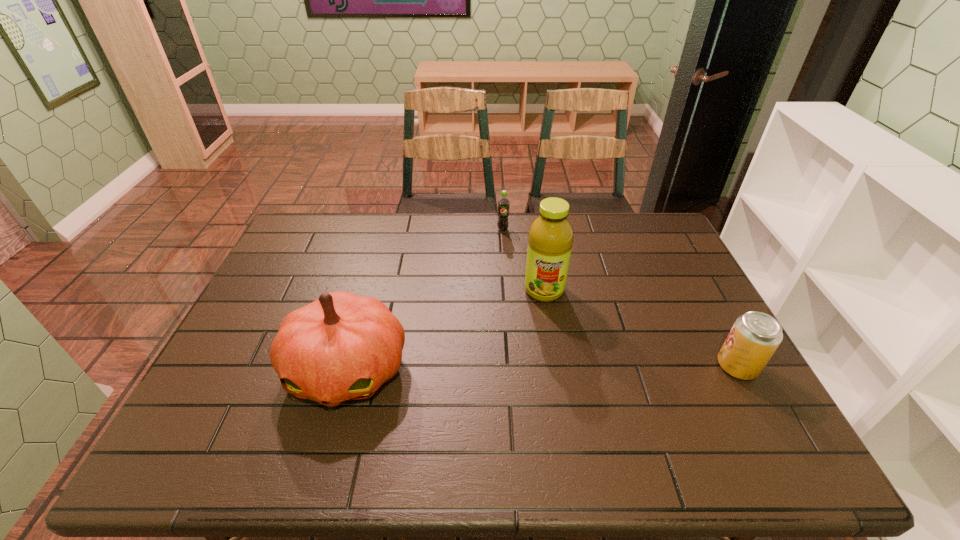
Where is `free space at the left edge`? The image size is (960, 540). free space at the left edge is located at coordinates (267, 279).

Where is `vacant space at the far right corner`? This screenshot has height=540, width=960. vacant space at the far right corner is located at coordinates (635, 226).

This screenshot has width=960, height=540. I want to click on blank region between the nearer soda and the pumpkin, so click(x=542, y=368).

Where is `free point between the second object from left to right and the third nearest object`? Image resolution: width=960 pixels, height=540 pixels. free point between the second object from left to right and the third nearest object is located at coordinates (523, 260).

At what (x,y) coordinates should I click in order to perform the action: click on empty space between the third object from right to left and the right soda. Please return your answer as a coordinate pair (x, y). Looking at the image, I should click on (620, 298).

This screenshot has width=960, height=540. I want to click on vacant space that's between the fruit juice and the left soda, so click(523, 260).

Find the location of `unoccupied area between the leftmost object and the second object from left to right`. unoccupied area between the leftmost object and the second object from left to right is located at coordinates (425, 300).

Locate an element on the screen. This screenshot has height=540, width=960. free space between the right soda and the farthest object is located at coordinates [620, 298].

Find the location of a particular element. The width and height of the screenshot is (960, 540). free space between the farthest object and the nearer soda is located at coordinates (620, 298).

Where is `unoccupied position between the third object from right to left and the second farthest object`? unoccupied position between the third object from right to left and the second farthest object is located at coordinates (523, 260).